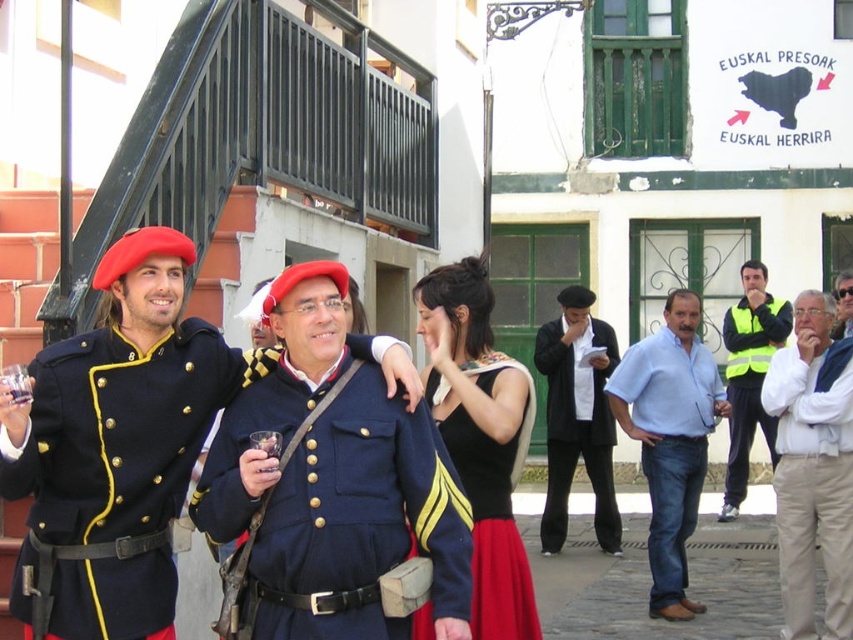
Question: Is light blue cotton shirt at center below matte black uniform at center?

Choices:
 (A) no
 (B) yes

Answer: (B)

Question: Among these objects, which one is nearest to the camera?

Choices:
 (A) blue cotton uniform at center
 (B) white cotton shirt at center

Answer: (A)

Question: Is blue cotton uniform at center further to the viewer compared to yellow reflective vest at right?

Choices:
 (A) no
 (B) yes

Answer: (A)

Question: Among these points, which one is nearest to the camera?

Choices:
 (A) (370, 509)
 (B) (833, 330)

Answer: (A)

Question: Can you confirm if blue cotton uniform at center is wider than light blue cotton shirt at center?

Choices:
 (A) no
 (B) yes

Answer: (B)

Question: Which object is the closest to the black satin dress at center?

Choices:
 (A) matte blue uniform at center
 (B) white cotton shirt at center
 (C) light blue cotton shirt at center
 (D) yellow reflective vest at right

Answer: (A)